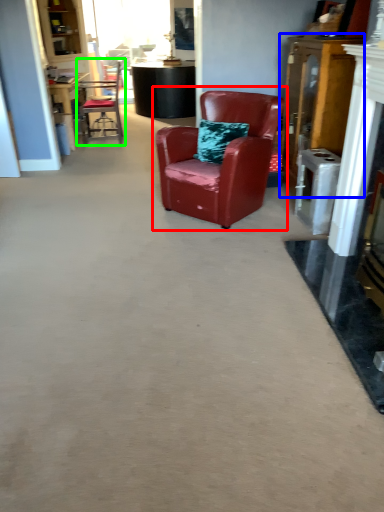
Question: Which is nearer to the chair (highlighted by a red box)? dresser (highlighted by a blue box) or chair (highlighted by a green box).

Choices:
 (A) dresser
 (B) chair

Answer: (A)